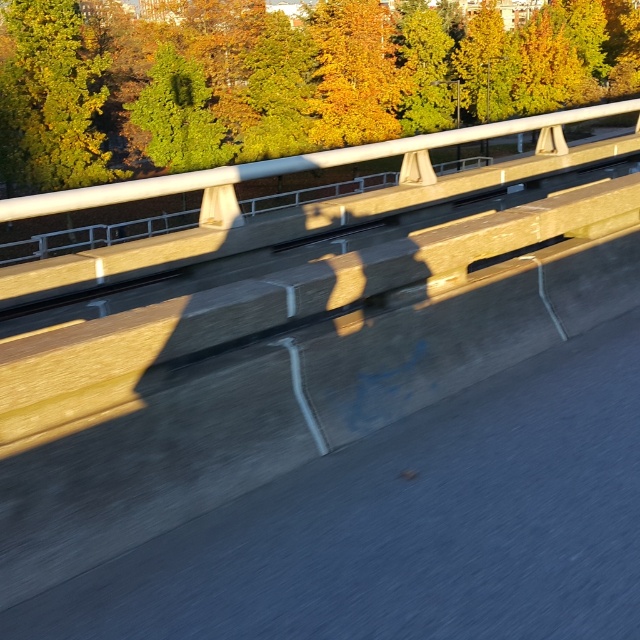
You are driving a car and see the green leafy tree at upper center and the green leafy tree at upper left in your rearview mirror. Which tree is closer to the right side of the mirror?

The green leafy tree at upper center is positioned on the right side of the green leafy tree at upper left, so the green leafy tree at upper center is closer to the right side of the mirror.

You are a photographer trying to capture the green leafy tree at upper center in the center of your photo. Based on the scene description, where should you position your camera relative to the point marked at coordinates (316, 81)?

The green leafy tree at upper center is already located at point (316, 81), so positioning your camera directly at that point would center the tree in your photo.

You are a photographer trying to capture the green leafy tree at upper center and the green leafy tree at upper left in the same frame. Which tree should you focus on to ensure both are visible without zooming in?

The green leafy tree at upper center has a greater width than the green leafy tree at upper left, so focusing on the wider tree would allow both to fit in the frame without zooming in.